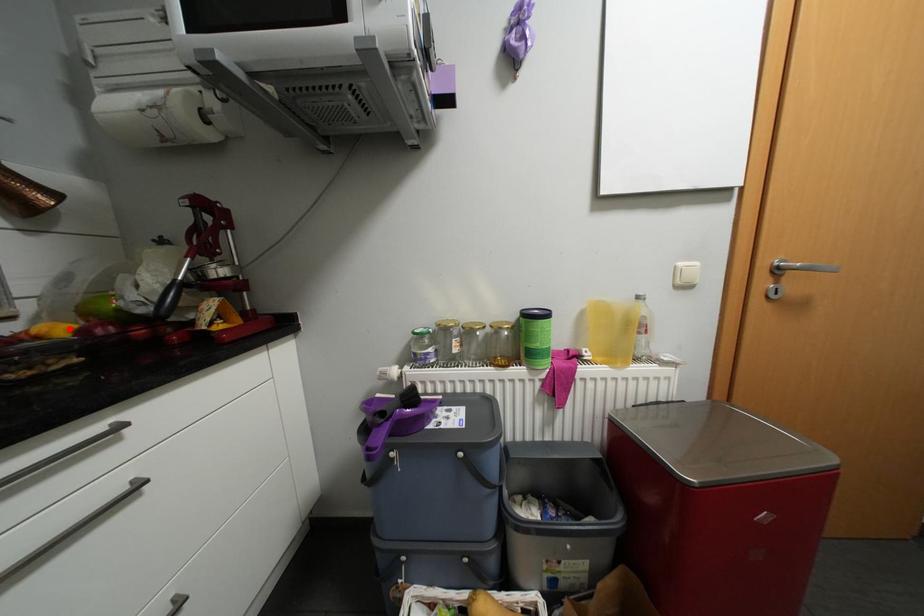
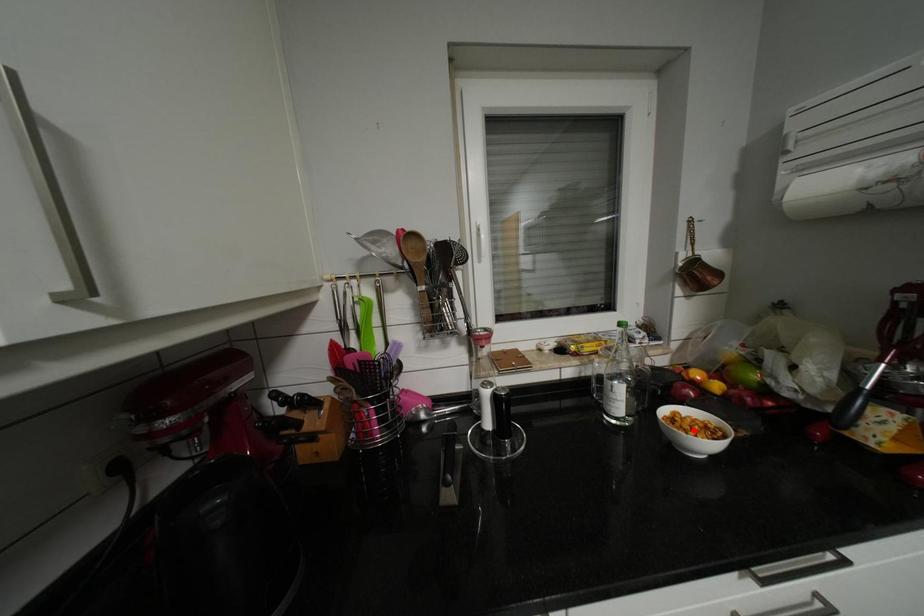
I am providing you with two images of the same scene from different viewpoints. A red point is marked on the first image and another point is marked on the second image. Does the point marked in image1 correspond to the same location as the one in image2?

No